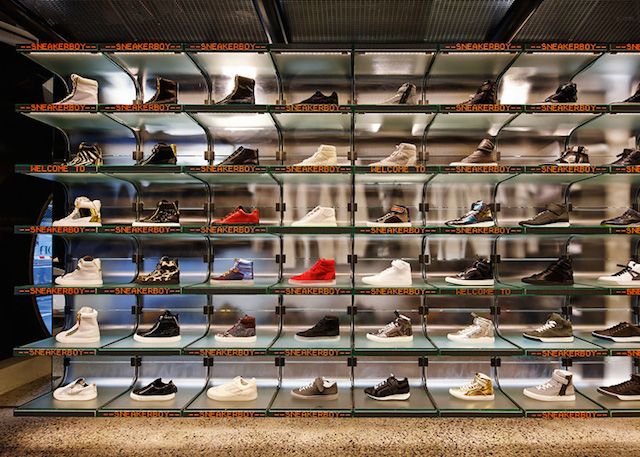
At what (x,y) coordinates should I click in order to perform the action: click on the 4th shelve. Please return your answer as a coordinate pair (x, y). Looking at the image, I should click on (68, 227), (148, 228), (236, 230), (314, 227), (381, 224), (456, 230), (540, 228), (609, 228).